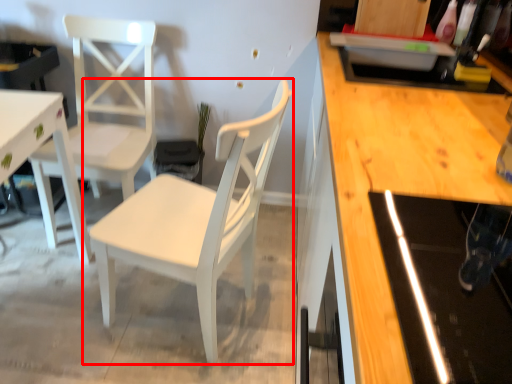
Question: From the image, what is the correct spatial relationship of chair (annotated by the red box) in relation to chair?

Choices:
 (A) right
 (B) left

Answer: (A)